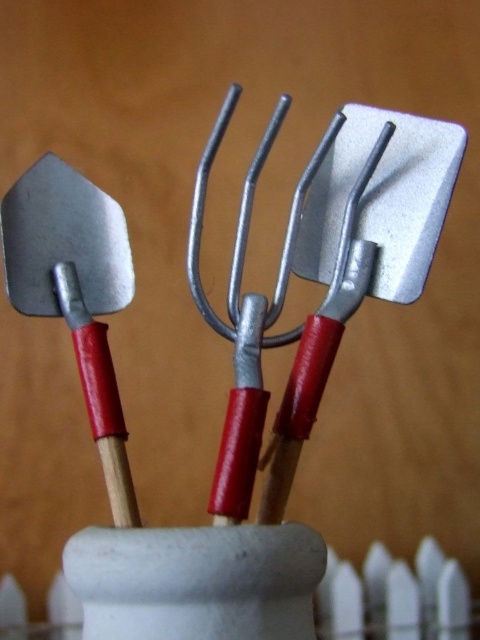
You are standing in front of the gardening tools holder. There are two points marked on the tools. The first point is at coordinates point [374,115] and the second point is at point [15,186]. Which point is closer to you?

Point [15,186] is closer to you because it is in front of point [374,115].

You are organizing a gardening tool display. You have a shelf that can only accommodate tools up to 10 cm in width. You see the metallic silver spatula at center and the matte silver shovel at left. Which tool should you place on the shelf to ensure it fits?

The matte silver shovel at left should be placed on the shelf because its width is smaller than the metallic silver spatula at center, and the shelf can hold tools up to 10 cm. Since the spatula is wider, the shovel is more likely to fit within the 10 cm limit.

You are organizing tools in a kitchen drawer and see the metallic silver spatula at center and the matte silver shovel at left. Which tool is located to the right of the other?

The metallic silver spatula at center is positioned on the right side of the matte silver shovel at left.